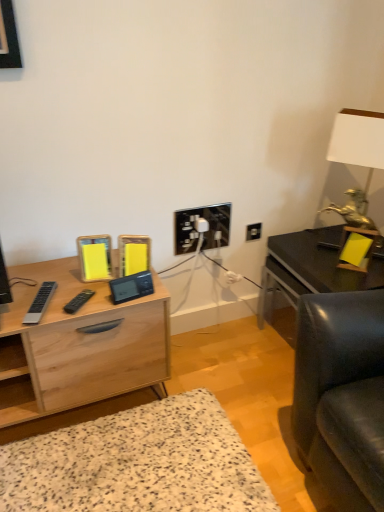
Question: From a real-world perspective, is light wood desk at center positioned over black plastic electric outlet at center based on gravity?

Choices:
 (A) no
 (B) yes

Answer: (A)

Question: From a real-world perspective, is light wood desk at center beneath black plastic electric outlet at center?

Choices:
 (A) yes
 (B) no

Answer: (A)

Question: Does light wood desk at center lie behind black plastic electric outlet at center?

Choices:
 (A) no
 (B) yes

Answer: (A)

Question: Is light wood desk at center beside black plastic electric outlet at center?

Choices:
 (A) yes
 (B) no

Answer: (B)

Question: Considering the relative sizes of light wood desk at center and black plastic electric outlet at center in the image provided, is light wood desk at center thinner than black plastic electric outlet at center?

Choices:
 (A) yes
 (B) no

Answer: (B)

Question: Considering the relative positions of light wood desk at center and black plastic electric outlet at center in the image provided, is light wood desk at center to the left of black plastic electric outlet at center from the viewer's perspective?

Choices:
 (A) yes
 (B) no

Answer: (A)

Question: Is white matte table lamp at upper right looking in the opposite direction of light wood desk at center?

Choices:
 (A) yes
 (B) no

Answer: (B)

Question: Is white matte table lamp at upper right wider than light wood desk at center?

Choices:
 (A) yes
 (B) no

Answer: (B)

Question: Can you confirm if white matte table lamp at upper right is bigger than light wood desk at center?

Choices:
 (A) no
 (B) yes

Answer: (A)

Question: From a real-world perspective, is white matte table lamp at upper right over light wood desk at center?

Choices:
 (A) no
 (B) yes

Answer: (B)

Question: Is white matte table lamp at upper right taller than light wood desk at center?

Choices:
 (A) no
 (B) yes

Answer: (B)

Question: Is white matte table lamp at upper right at the left side of light wood desk at center?

Choices:
 (A) yes
 (B) no

Answer: (B)

Question: Is matte black table at right taller than light wood desk at center?

Choices:
 (A) yes
 (B) no

Answer: (A)